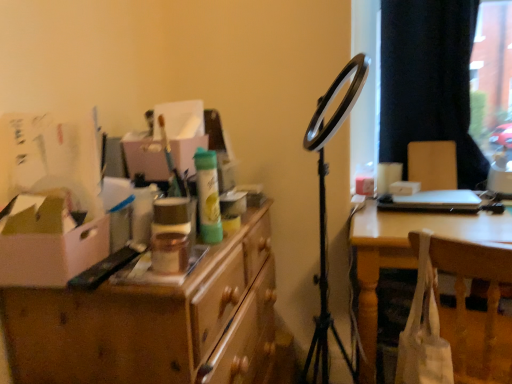
Question: Is wooden chair at right oriented away from white cardboard box at left?

Choices:
 (A) no
 (B) yes

Answer: (A)

Question: Can you confirm if wooden chair at right is smaller than white cardboard box at left?

Choices:
 (A) yes
 (B) no

Answer: (B)

Question: From a real-world perspective, does wooden chair at right stand above white cardboard box at left?

Choices:
 (A) no
 (B) yes

Answer: (B)

Question: Does wooden chair at right lie in front of white cardboard box at left?

Choices:
 (A) yes
 (B) no

Answer: (B)

Question: From a real-world perspective, is wooden chair at right located beneath white cardboard box at left?

Choices:
 (A) yes
 (B) no

Answer: (B)

Question: Looking at their shapes, would you say wooden desk at left is wider or thinner than black fabric curtain at upper right?

Choices:
 (A) thin
 (B) wide

Answer: (B)

Question: In terms of height, does wooden desk at left look taller or shorter compared to black fabric curtain at upper right?

Choices:
 (A) tall
 (B) short

Answer: (B)

Question: From the image's perspective, is wooden desk at left above or below black fabric curtain at upper right?

Choices:
 (A) above
 (B) below

Answer: (B)

Question: Considering the positions of wooden desk at left and black fabric curtain at upper right in the image, is wooden desk at left bigger or smaller than black fabric curtain at upper right?

Choices:
 (A) big
 (B) small

Answer: (A)

Question: In the image, is wooden chair at right positioned in front of or behind metallic gold jar at center, which is the 2th toiletry in back-to-front order?

Choices:
 (A) front
 (B) behind

Answer: (B)

Question: From the image's perspective, relative to metallic gold jar at center, which is the 2th toiletry in back-to-front order, is wooden chair at right above or below?

Choices:
 (A) below
 (B) above

Answer: (B)

Question: Considering the positions of point (422, 175) and point (174, 243), is point (422, 175) closer or farther from the camera than point (174, 243)?

Choices:
 (A) farther
 (B) closer

Answer: (A)

Question: Considering the positions of wooden chair at right and metallic gold jar at center, acting as the first toiletry starting from the front, in the image, is wooden chair at right taller or shorter than metallic gold jar at center, acting as the first toiletry starting from the front,?

Choices:
 (A) tall
 (B) short

Answer: (A)

Question: Based on their sizes in the image, would you say wooden desk at left is bigger or smaller than green matte spray can at center, the 2th toiletry from the front?

Choices:
 (A) big
 (B) small

Answer: (A)

Question: Looking at their shapes, would you say wooden desk at left is wider or thinner than green matte spray can at center, the 2th toiletry from the front?

Choices:
 (A) wide
 (B) thin

Answer: (A)